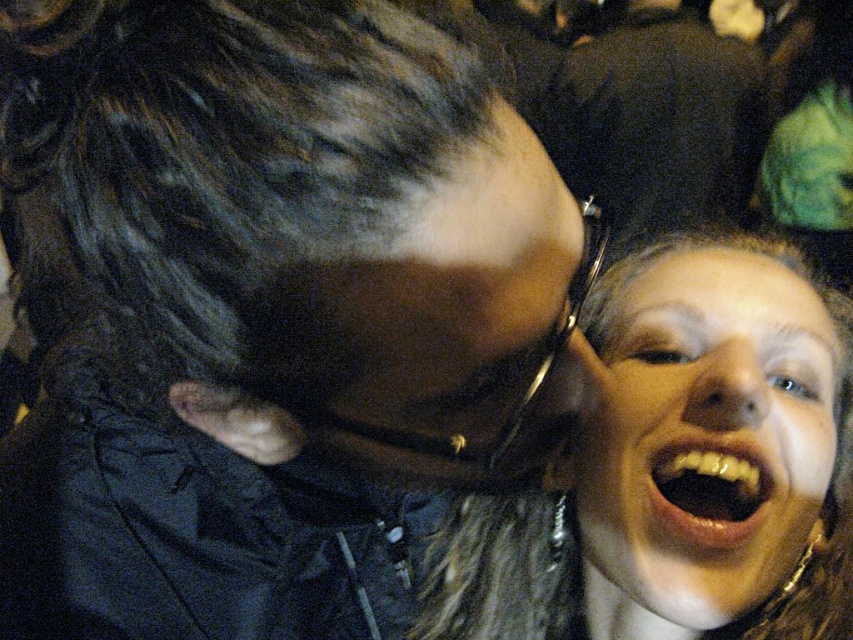
Question: Which of these objects is positioned closest to the smooth skin face at lower right?

Choices:
 (A) black matte hair at upper left
 (B) black plastic goggles at center

Answer: (A)

Question: Is smooth skin face at lower right positioned at the back of black plastic goggles at center?

Choices:
 (A) yes
 (B) no

Answer: (A)

Question: Is smooth glossy teeth at lower right below black plastic goggles at center?

Choices:
 (A) no
 (B) yes

Answer: (B)

Question: Is black matte hair at upper left to the right of smooth skin face at lower right from the viewer's perspective?

Choices:
 (A) no
 (B) yes

Answer: (A)

Question: Which is nearer to the smooth skin face at lower right?

Choices:
 (A) black plastic goggles at center
 (B) smooth glossy teeth at lower right
 (C) black matte hair at upper left

Answer: (B)

Question: Which of the following is the closest to the observer?

Choices:
 (A) click(x=585, y=278)
 (B) click(x=154, y=492)
 (C) click(x=634, y=572)

Answer: (A)